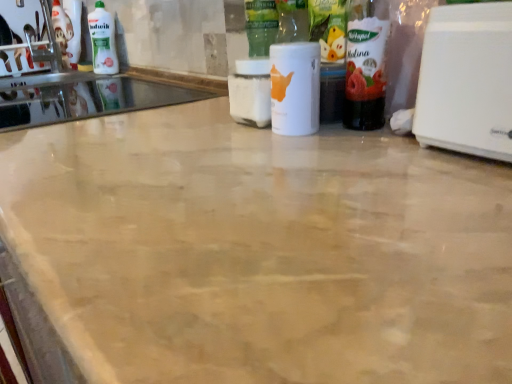
Question: From the image's perspective, relative to translucent plastic bottle at right, which is the second bottle from left to right, is white plastic toaster at right above or below?

Choices:
 (A) below
 (B) above

Answer: (A)

Question: In terms of size, does white plastic toaster at right appear bigger or smaller than translucent plastic bottle at right, which is the second bottle from left to right?

Choices:
 (A) big
 (B) small

Answer: (A)

Question: Considering the real-world distances, which object is closest to the white matte bottle at center, the first bottle viewed from the left?

Choices:
 (A) white plastic toaster at right
 (B) white glossy sink at upper left
 (C) white glossy bottle at upper left
 (D) translucent plastic bottle at right, which is the second bottle from left to right

Answer: (D)

Question: Considering the real-world distances, which object is closest to the white matte bottle at center, the 2th bottle when ordered from right to left?

Choices:
 (A) translucent plastic bottle at right, which is the second bottle from left to right
 (B) white plastic toaster at right
 (C) white glossy sink at upper left
 (D) white glossy bottle at upper left

Answer: (A)